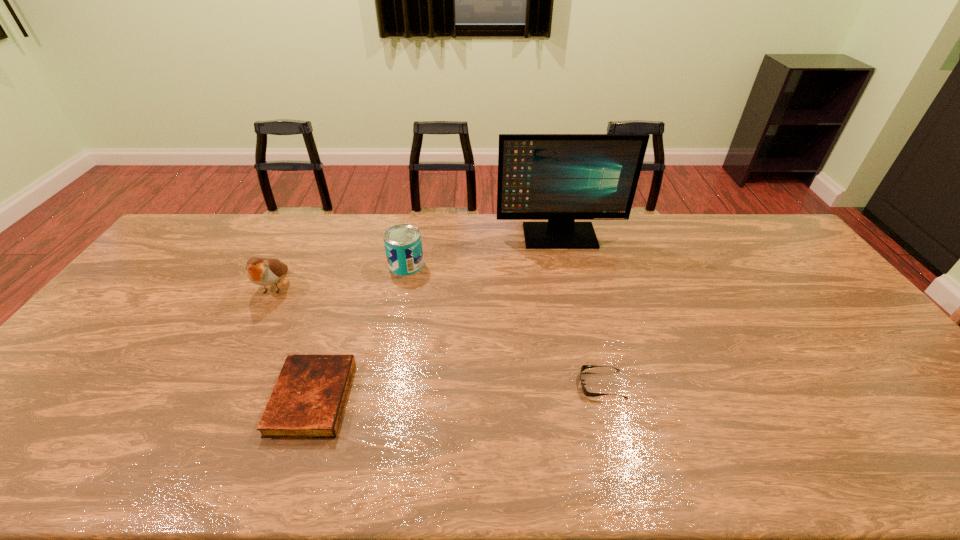
Locate an element on the screen. monitor is located at coordinates (561, 178).

Find the location of `the farthest object`. the farthest object is located at coordinates (561, 178).

Image resolution: width=960 pixels, height=540 pixels. What are the coordinates of `the leftmost object` in the screenshot? It's located at (261, 271).

Where is `bird`? bird is located at coordinates (261, 271).

I want to click on the third tallest object, so click(403, 245).

I want to click on the third object from left to right, so click(403, 245).

The image size is (960, 540). In order to click on the second shortest object in this screenshot , I will do `click(308, 399)`.

Locate an element on the screen. The image size is (960, 540). Bible is located at coordinates (308, 399).

Identify the location of sunglasses. (586, 393).

Where is `blank area located on the screen side of the tallest object`? Image resolution: width=960 pixels, height=540 pixels. blank area located on the screen side of the tallest object is located at coordinates (573, 296).